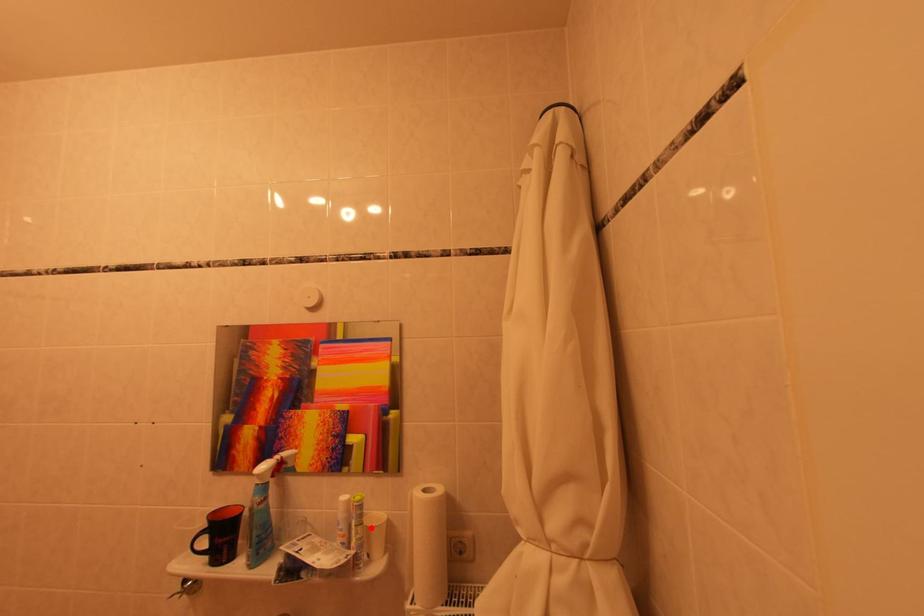
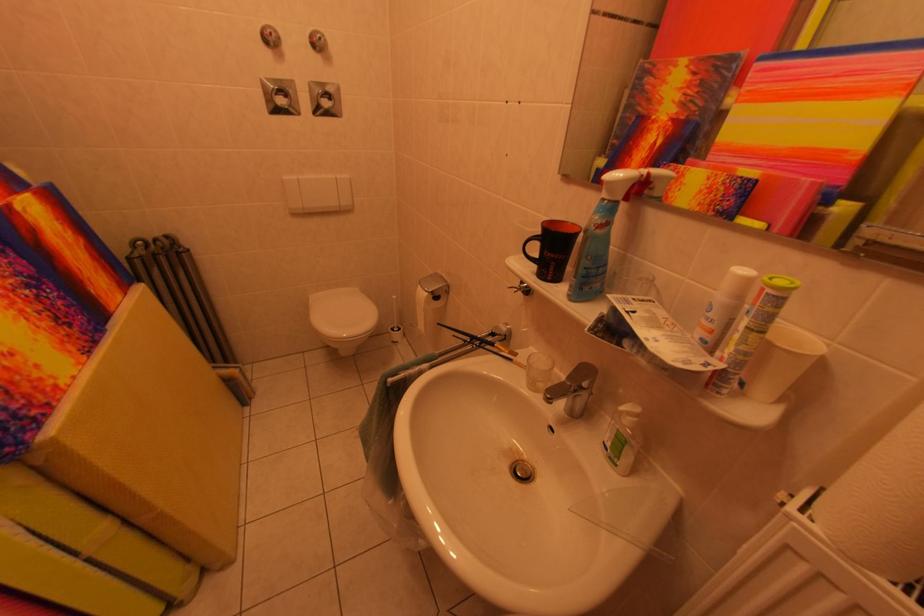
Locate, in the second image, the point that corresponds to the highlighted location in the first image.

(773, 336)